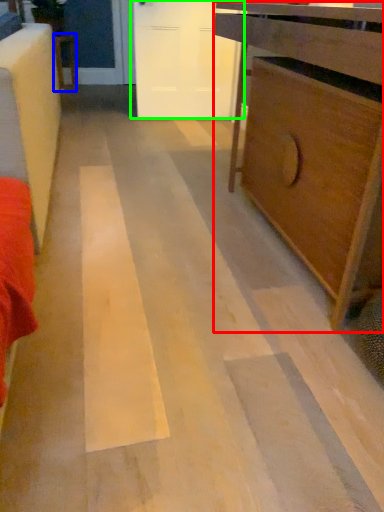
Question: Which object is positioned closest to chest of drawers (highlighted by a red box)? Select from furniture (highlighted by a blue box) and door (highlighted by a green box).

Choices:
 (A) furniture
 (B) door

Answer: (B)